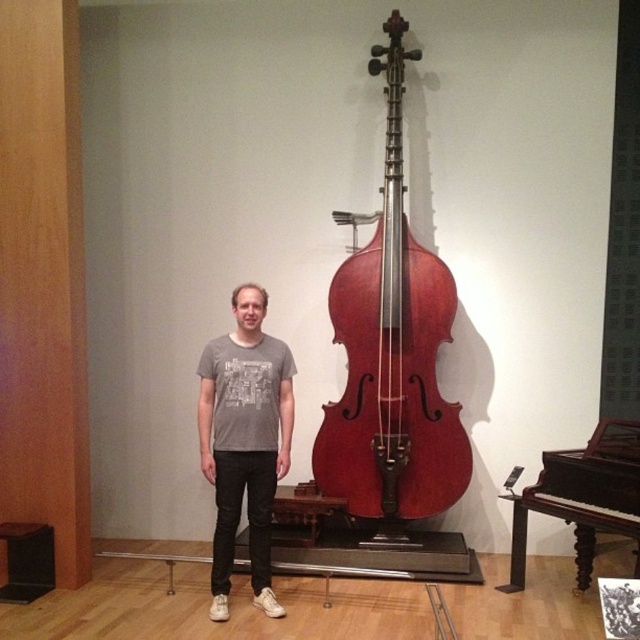
You are standing in the museum gallery and want to sit down. You see the polished dark wood piano at lower right and the black wood stool at lower left. Which object is positioned to the right side of the other?

The polished dark wood piano at lower right is to the right of the black wood stool at lower left.